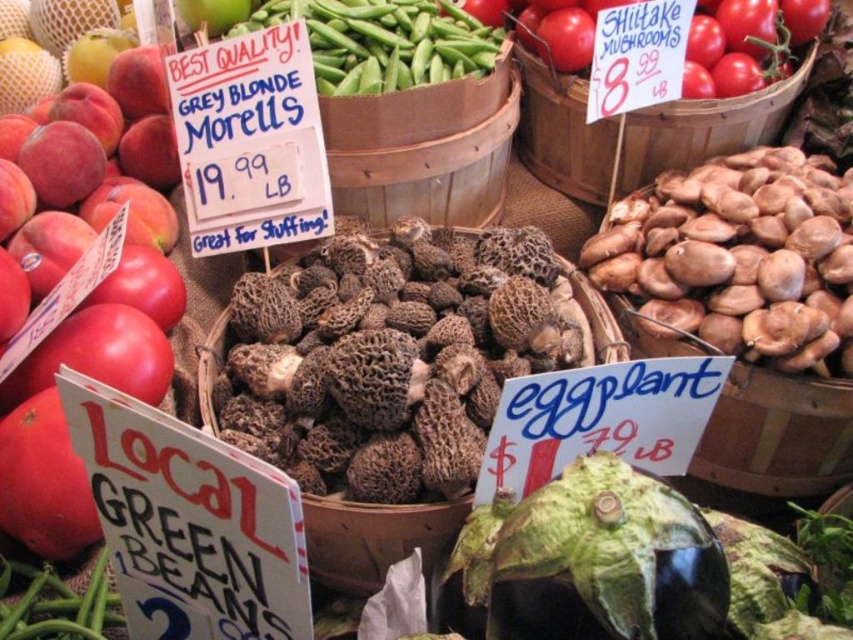
Does black fuzzy mushrooms at center come in front of red matte tomatoes at upper right?

That is True.

Can you confirm if black fuzzy mushrooms at center is taller than red matte tomatoes at upper right?

Yes, black fuzzy mushrooms at center is taller than red matte tomatoes at upper right.

You are a GUI agent. You are given a task and a screenshot of the screen. Output one action in this format:
    pyautogui.click(x=<x>, y=<y>)
    Task: Click on the black fuzzy mushrooms at center
    The image size is (853, 640).
    Given the screenshot: What is the action you would take?
    pyautogui.click(x=392, y=356)

This screenshot has height=640, width=853. In order to click on black fuzzy mushrooms at center in this screenshot , I will do `click(392, 356)`.